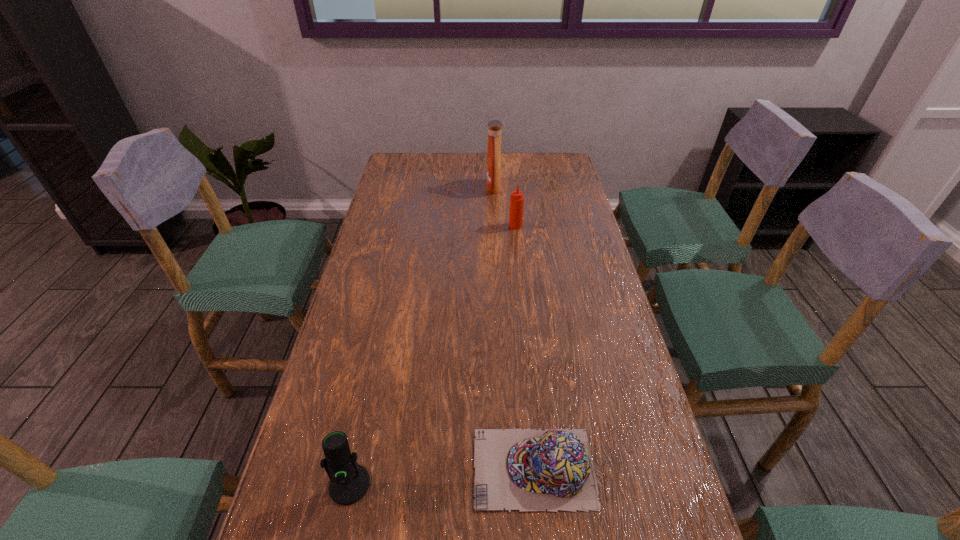
Identify which object is located as the third nearest to the cap. Please provide its 2D coordinates. Your answer should be formatted as a tuple, i.e. [(x, y)], where the tuple contains the x and y coordinates of a point satisfying the conditions above.

[(494, 126)]

I want to click on the closest object to the Tabasco sauce, so click(x=494, y=126).

What are the coordinates of `free space that satisfies the following two spatial constraints: 1. on the front-facing side of the detergent; 2. on the back side of the Tabasco sauce` in the screenshot? It's located at (495, 226).

Where is `free spot that satisfies the following two spatial constraints: 1. on the front-facing side of the detergent; 2. on the left side of the third nearest object`? free spot that satisfies the following two spatial constraints: 1. on the front-facing side of the detergent; 2. on the left side of the third nearest object is located at coordinates (495, 226).

Locate an element on the screen. This screenshot has height=540, width=960. vacant point that satisfies the following two spatial constraints: 1. on the front-facing side of the Tabasco sauce; 2. on the right side of the detergent is located at coordinates (495, 226).